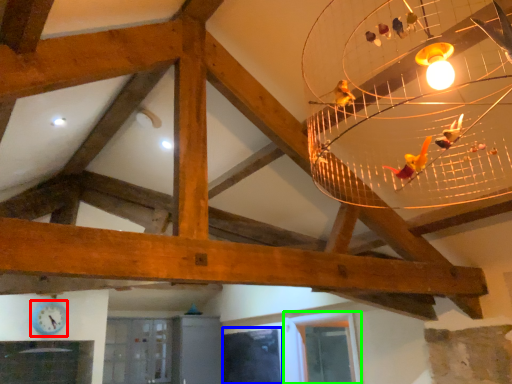
Question: Based on their relative distances, which object is nearer to clock (highlighted by a red box)? Choose from window (highlighted by a blue box) and window (highlighted by a green box).

Choices:
 (A) window
 (B) window

Answer: (A)